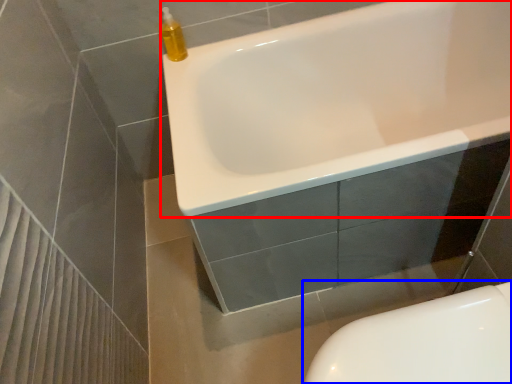
Question: Among these objects, which one is farthest to the camera, bathtub (highlighted by a red box) or toilet (highlighted by a blue box)?

Choices:
 (A) bathtub
 (B) toilet

Answer: (A)